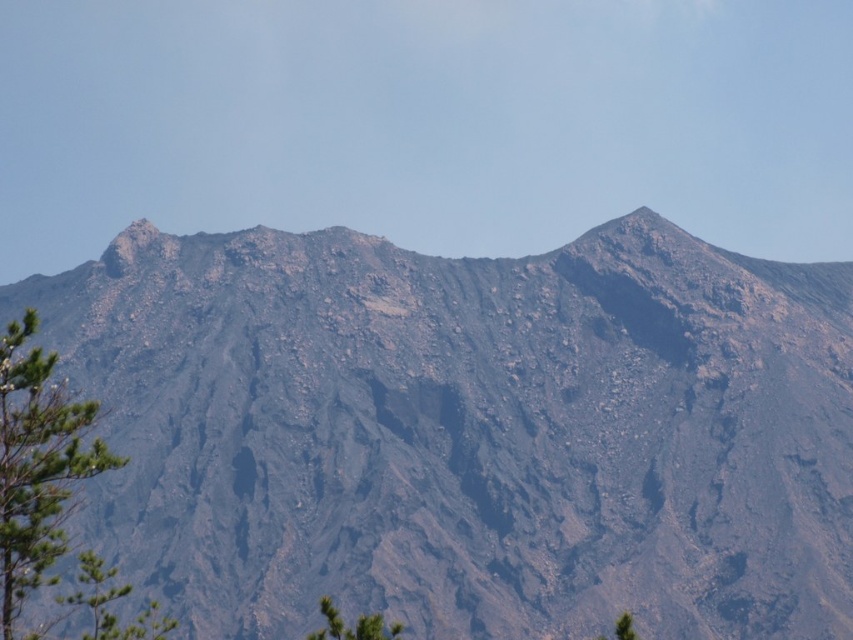
You are a hiker standing at the base of the mountain and want to reach the closest green leafy tree. Which tree should you head towards, the green leafy tree at left or the green leafy tree at lower left?

The green leafy tree at left is closer to the viewer than the green leafy tree at lower left, so you should head towards the green leafy tree at left.

You are a hiker who wants to take a photo of the rugged stone mountain at center and the green leafy tree at left. Which object should you focus on first if you want to capture both in a single frame without moving your camera?

You should focus on the rugged stone mountain at center first because it is taller than the green leafy tree at left, so it will occupy more of the frame and ensure both are visible.